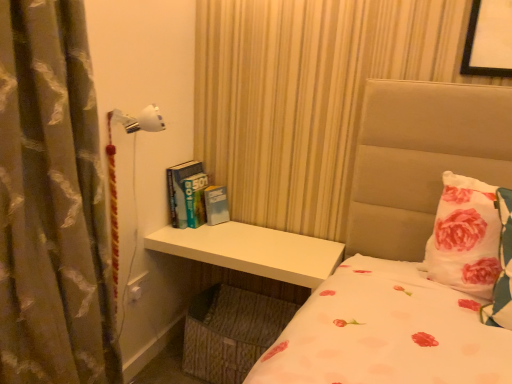
Question: Is hardcover books at center aimed at silky brown curtain at left?

Choices:
 (A) yes
 (B) no

Answer: (A)

Question: Is hardcover books at center outside silky brown curtain at left?

Choices:
 (A) no
 (B) yes

Answer: (B)

Question: Considering the relative sizes of hardcover books at center and silky brown curtain at left in the image provided, is hardcover books at center taller than silky brown curtain at left?

Choices:
 (A) yes
 (B) no

Answer: (B)

Question: Does hardcover books at center appear on the right side of silky brown curtain at left?

Choices:
 (A) yes
 (B) no

Answer: (A)

Question: Does hardcover books at center have a lesser height compared to silky brown curtain at left?

Choices:
 (A) yes
 (B) no

Answer: (A)

Question: From a real-world perspective, is white floral pillow at right positioned above or below hardcover books at center?

Choices:
 (A) below
 (B) above

Answer: (B)

Question: In terms of height, does white floral pillow at right look taller or shorter compared to hardcover books at center?

Choices:
 (A) tall
 (B) short

Answer: (A)

Question: Does point (478, 183) appear closer or farther from the camera than point (183, 180)?

Choices:
 (A) closer
 (B) farther

Answer: (A)

Question: From the image's perspective, is white floral pillow at right located above or below hardcover books at center?

Choices:
 (A) below
 (B) above

Answer: (A)

Question: Relative to silky brown curtain at left, is hardcover books at center in front or behind?

Choices:
 (A) front
 (B) behind

Answer: (B)

Question: Looking at their shapes, would you say hardcover books at center is wider or thinner than silky brown curtain at left?

Choices:
 (A) thin
 (B) wide

Answer: (A)

Question: From a real-world perspective, is hardcover books at center physically located above or below silky brown curtain at left?

Choices:
 (A) above
 (B) below

Answer: (B)

Question: From the image's perspective, is hardcover books at center located above or below silky brown curtain at left?

Choices:
 (A) below
 (B) above

Answer: (B)

Question: From a real-world perspective, is hardcover books at center positioned above or below white floral pillow at right?

Choices:
 (A) above
 (B) below

Answer: (B)

Question: From the image's perspective, is hardcover books at center positioned above or below white floral pillow at right?

Choices:
 (A) below
 (B) above

Answer: (B)